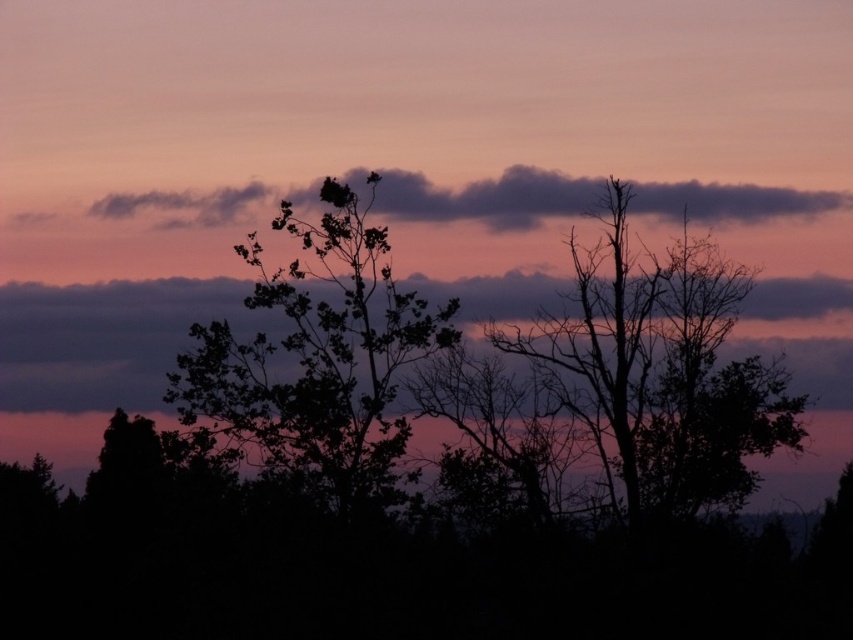
You are a bird flying at a constant height. You see the silhouette leafy tree at center and the dark purple cloud at upper center. Which object is closer to you?

The silhouette leafy tree at center is closer to you because it is in the foreground, while the dark purple cloud at upper center is in the background, making them 7.15 meters apart.

You are standing in the sunset scene and want to identify the exact location of the point marked at coordinates point (x=317, y=356). Which object in the scene does this point belong to?

The point (x=317, y=356) is located on the silhouette leafy tree at center.

You are a drone operator planning to fly a drone between the silhouette bare tree at right and the dark purple cloud at upper center. The drone has a maximum flight distance of 6 meters. Can the drone safely make the trip without exceeding its range?

The distance between the silhouette bare tree at right and the dark purple cloud at upper center is 6.43 meters, which exceeds the drone maximum flight distance of 6 meters. The drone cannot safely make the trip without exceeding its range.